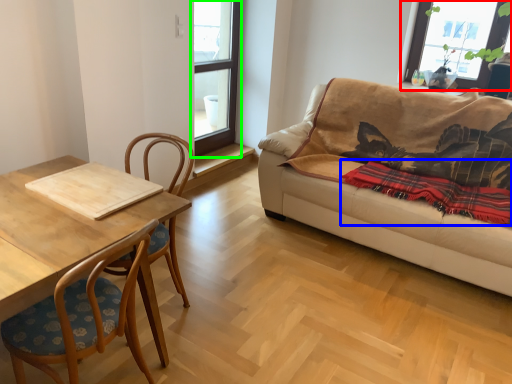
Question: Which is farther away from window (highlighted by a red box)? blanket (highlighted by a blue box) or window (highlighted by a green box)?

Choices:
 (A) blanket
 (B) window

Answer: (B)